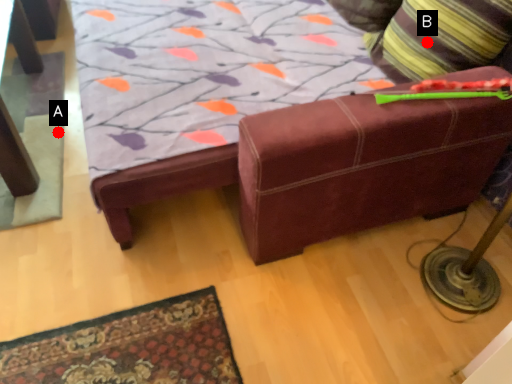
Question: Two points are circled on the image, labeled by A and B beside each circle. Which point is farther from the camera taking this photo?

Choices:
 (A) A is further
 (B) B is further

Answer: (A)